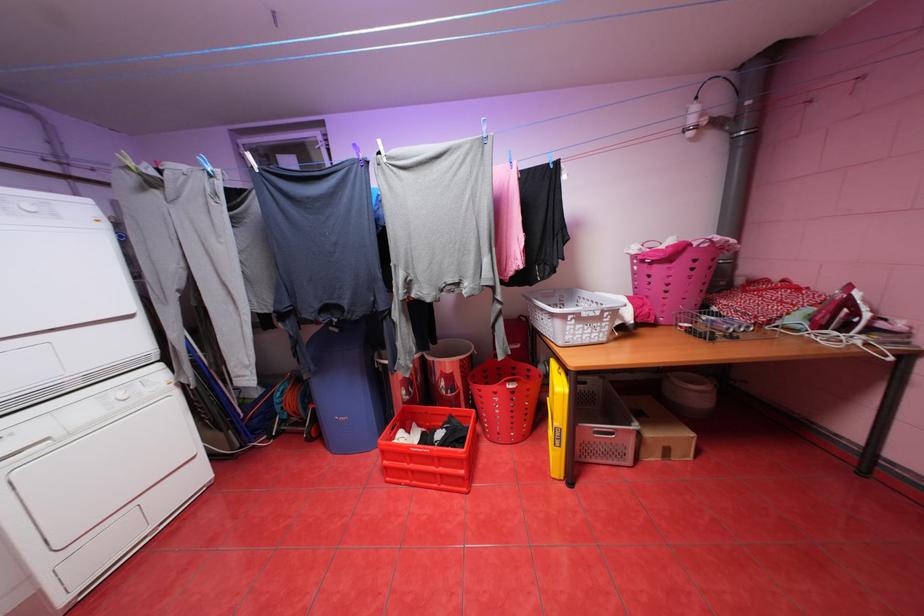
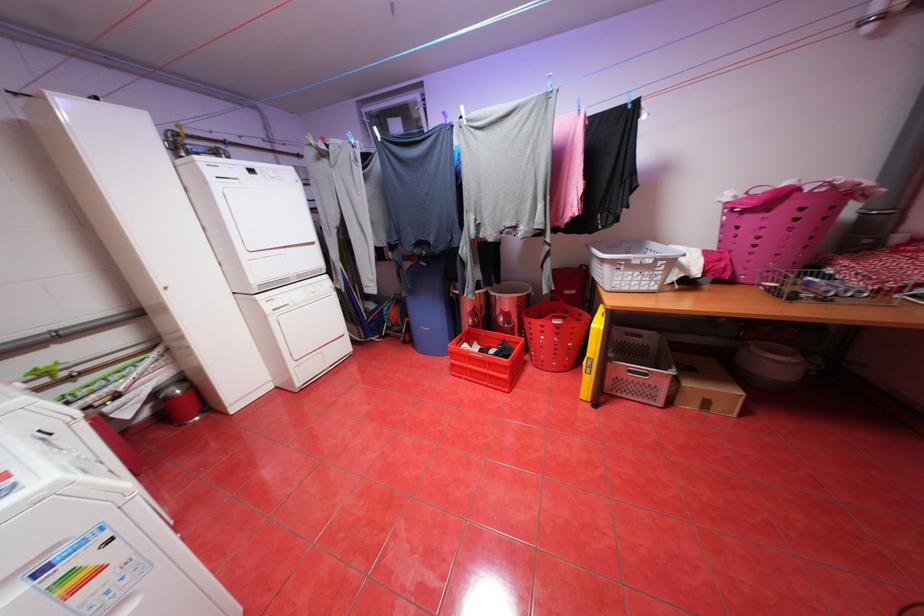
Locate, in the second image, the point that corresponds to the point at 428,424 in the first image.

(488, 344)